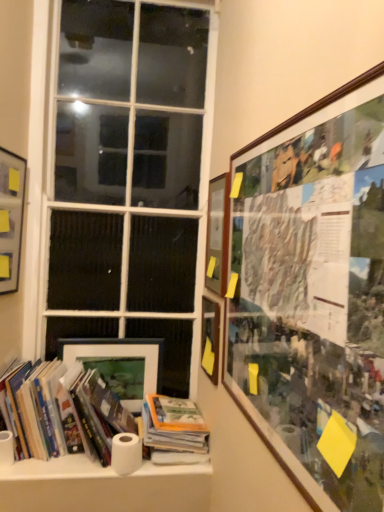
Question: From a real-world perspective, is white matte paper towel at lower left positioned over hardcover book at center, the 1th book when ordered from right to left, based on gravity?

Choices:
 (A) yes
 (B) no

Answer: (B)

Question: Can you confirm if white matte paper towel at lower left is smaller than hardcover book at center, the 1th book when ordered from right to left?

Choices:
 (A) no
 (B) yes

Answer: (B)

Question: Is white matte paper towel at lower left shorter than hardcover book at center, the 1th book when ordered from right to left?

Choices:
 (A) no
 (B) yes

Answer: (B)

Question: Does white matte paper towel at lower left appear on the left side of hardcover book at center, marked as the 2th book in a left-to-right arrangement?

Choices:
 (A) no
 (B) yes

Answer: (B)

Question: Is white matte paper towel at lower left located outside hardcover book at center, the 1th book when ordered from right to left?

Choices:
 (A) yes
 (B) no

Answer: (A)

Question: Would you say white matte toilet paper at lower center is inside or outside wooden framed collage at upper right, the 1th picture frame viewed from the right?

Choices:
 (A) inside
 (B) outside

Answer: (B)

Question: From a real-world perspective, is white matte toilet paper at lower center positioned above or below wooden framed collage at upper right, the 1th picture frame viewed from the right?

Choices:
 (A) above
 (B) below

Answer: (B)

Question: Is white matte toilet paper at lower center wider or thinner than wooden framed collage at upper right, which is the 5th picture frame in left-to-right order?

Choices:
 (A) wide
 (B) thin

Answer: (A)

Question: From their relative heights in the image, would you say white matte toilet paper at lower center is taller or shorter than wooden framed collage at upper right, which is the 5th picture frame in left-to-right order?

Choices:
 (A) tall
 (B) short

Answer: (B)

Question: From a real-world perspective, is matte black picture frame at upper left, the 5th picture frame when ordered from right to left, positioned above or below wooden framed collage at upper right, which is the 5th picture frame in left-to-right order?

Choices:
 (A) below
 (B) above

Answer: (B)

Question: In the image, is matte black picture frame at upper left, the first picture frame positioned from the left, positioned in front of or behind wooden framed collage at upper right, the 1th picture frame viewed from the right?

Choices:
 (A) front
 (B) behind

Answer: (B)

Question: Considering the positions of matte black picture frame at upper left, the first picture frame positioned from the left, and wooden framed collage at upper right, which is the 5th picture frame in left-to-right order, in the image, is matte black picture frame at upper left, the first picture frame positioned from the left, bigger or smaller than wooden framed collage at upper right, which is the 5th picture frame in left-to-right order,?

Choices:
 (A) big
 (B) small

Answer: (B)

Question: Is matte black picture frame at upper left, the 5th picture frame when ordered from right to left, wider or thinner than wooden framed collage at upper right, which is the 5th picture frame in left-to-right order?

Choices:
 (A) thin
 (B) wide

Answer: (A)

Question: Considering the positions of point (122, 454) and point (193, 415), is point (122, 454) closer or farther from the camera than point (193, 415)?

Choices:
 (A) closer
 (B) farther

Answer: (A)

Question: Choose the correct answer: Is white matte toilet paper at lower center inside hardcover book at center, marked as the 2th book in a left-to-right arrangement, or outside it?

Choices:
 (A) inside
 (B) outside

Answer: (B)